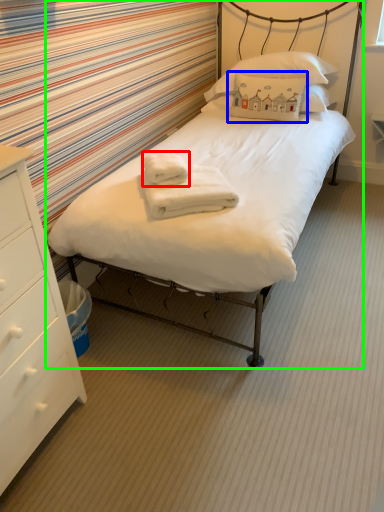
Question: Considering the real-world distances, which object is closest to bath towel (highlighted by a red box)? pillow (highlighted by a blue box) or bed (highlighted by a green box).

Choices:
 (A) pillow
 (B) bed

Answer: (B)